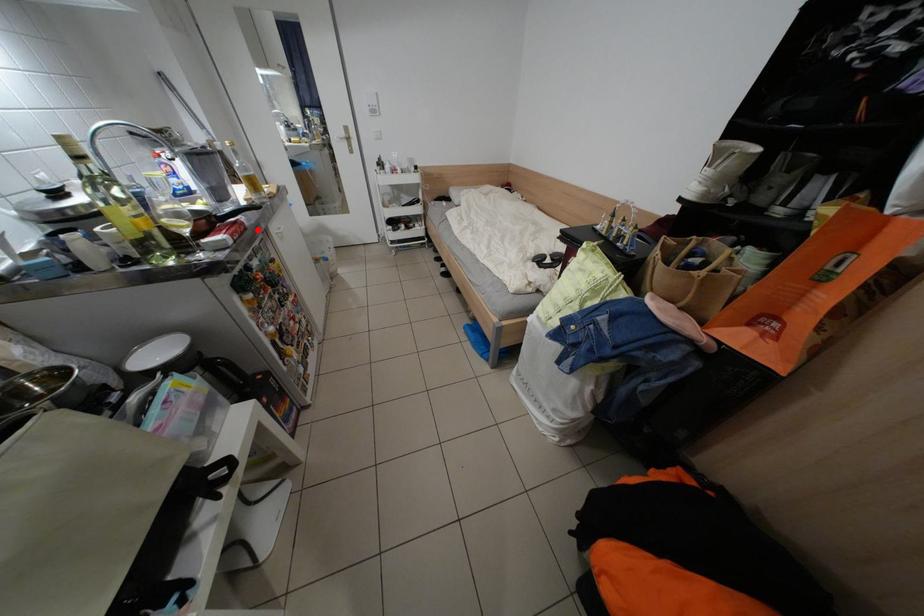
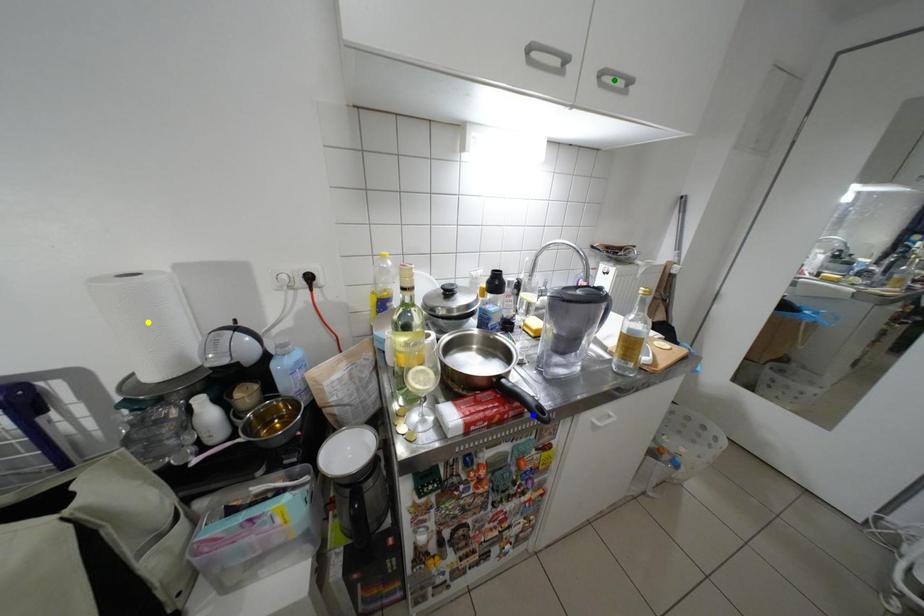
Question: I am providing you with two images of the same scene from different viewpoints. A red point is marked on the first image. You are given multiple points on the second image. Which point in image 2 is actually the same real-world point as the red point in image 1?

Choices:
 (A) green point
 (B) blue point
 (C) yellow point

Answer: (B)